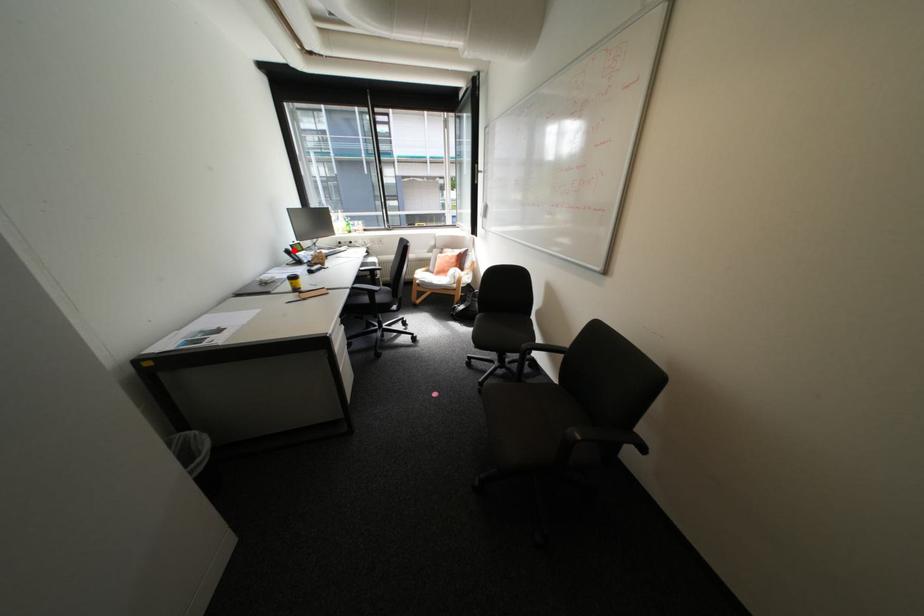
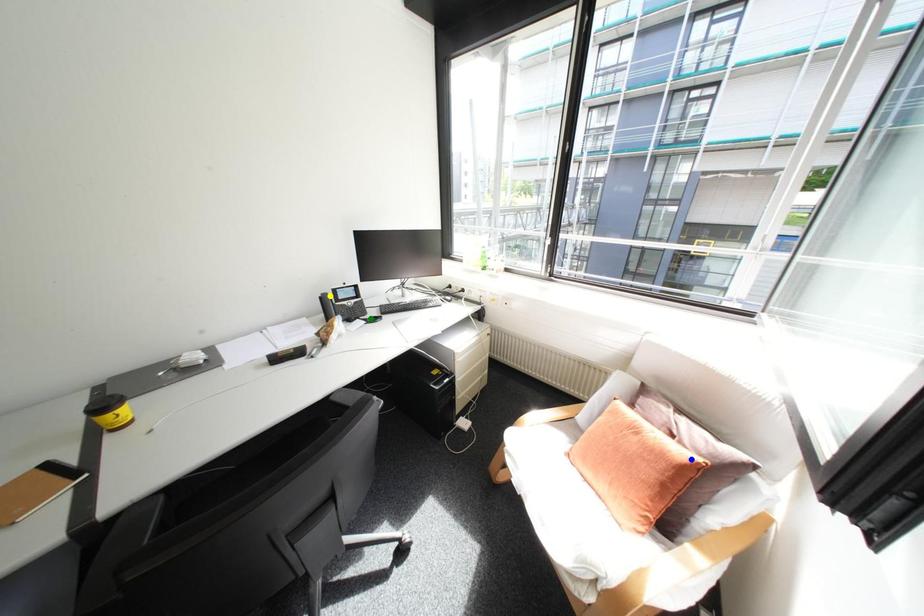
Question: I am providing you with two images of the same scene from different viewpoints. A red point is marked on the first image. You are given multiple points on the second image. Which point in image 2 is actually the same real-world point as the red point in image 1?

Choices:
 (A) green point
 (B) blue point
 (C) yellow point

Answer: (C)